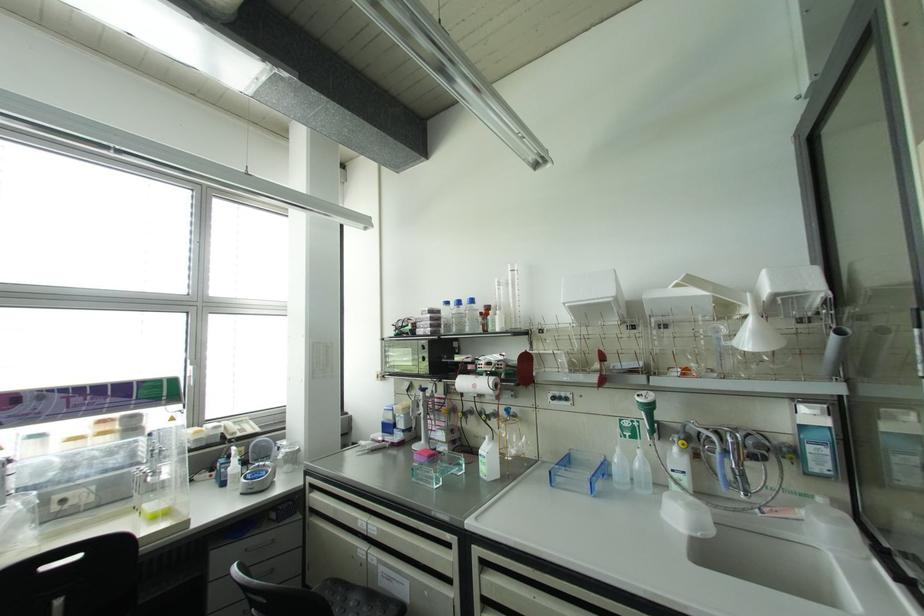
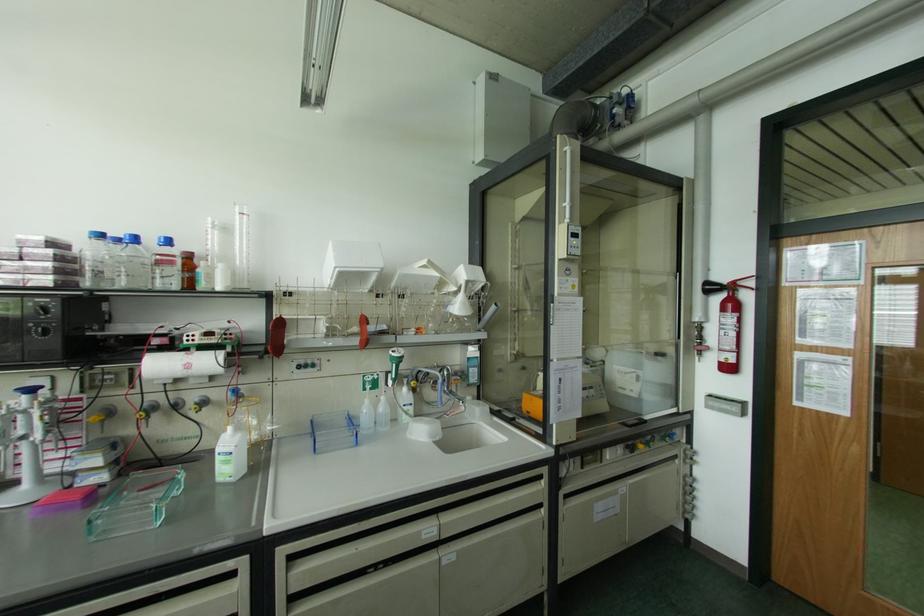
Find the pixel in the second image that matches pixel 471 301 in the first image.

(167, 241)